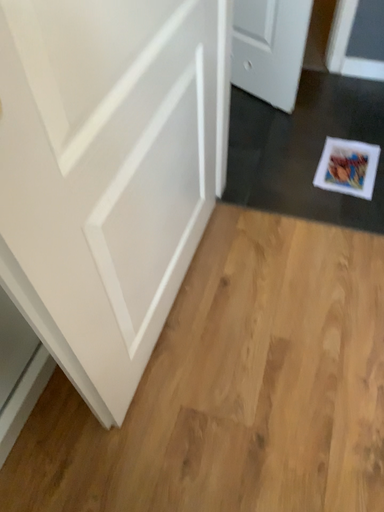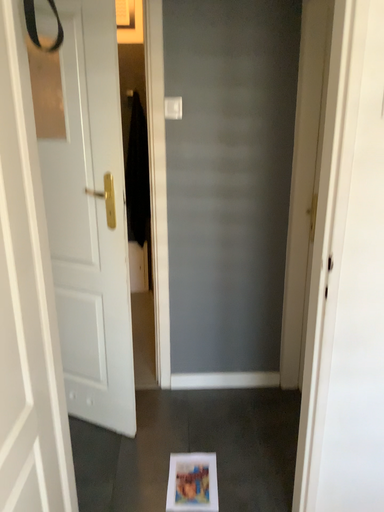
Question: Which way did the camera rotate in the video?

Choices:
 (A) rotated downward
 (B) rotated upward

Answer: (B)